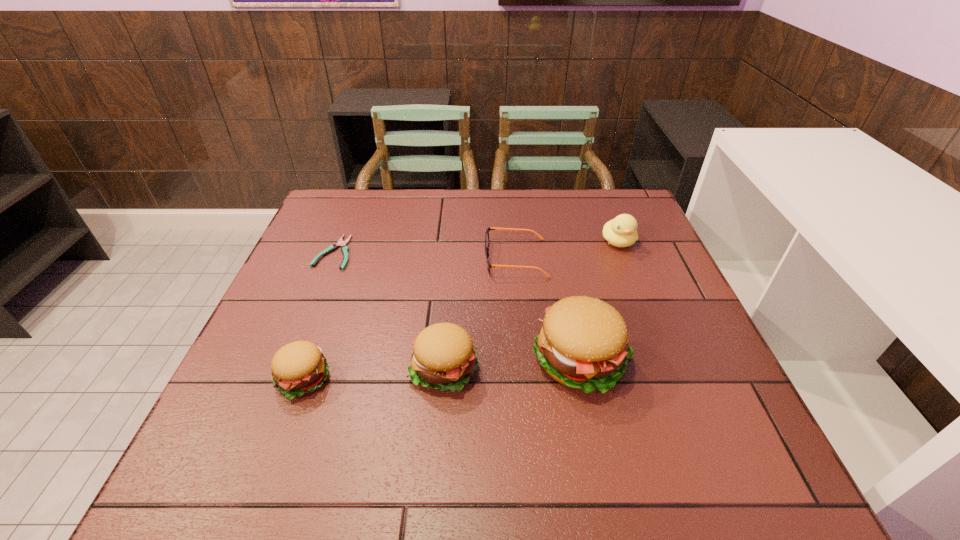
With all hamburgers evenly spaced, where should an extra hamburger be placed on the right to continue the pattern? Please point out a vacant space. Please provide its 2D coordinates. Your answer should be formatted as a tuple, i.e. [(x, y)], where the tuple contains the x and y coordinates of a point satisfying the conditions above.

[(713, 350)]